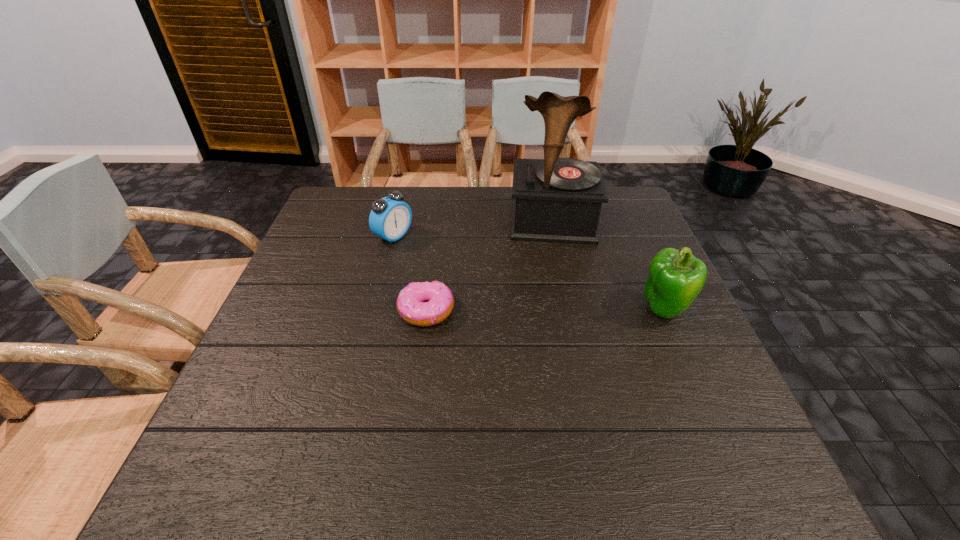
The height and width of the screenshot is (540, 960). In order to click on vacant space located 0.330m on the face of the alarm clock in this screenshot , I will do (x=505, y=294).

At what (x,y) coordinates should I click in order to perform the action: click on free space located at the horn opening of the third object from left to right. Please return your answer as a coordinate pair (x, y). The height and width of the screenshot is (540, 960). Looking at the image, I should click on (555, 269).

The image size is (960, 540). Identify the location of vacant space located 0.210m at the horn opening of the third object from left to right. (556, 298).

Where is `free space located 0.340m at the horn opening of the third object from left to right`? The width and height of the screenshot is (960, 540). free space located 0.340m at the horn opening of the third object from left to right is located at coordinates (559, 339).

Find the location of `alarm clock at the far edge`. alarm clock at the far edge is located at coordinates (390, 218).

The image size is (960, 540). I want to click on phonograph_record present at the far edge, so click(x=559, y=200).

This screenshot has height=540, width=960. What are the coordinates of `bell pepper that is at the right edge` in the screenshot? It's located at (675, 278).

In order to click on phonograph_record at the right edge in this screenshot , I will do `click(559, 200)`.

Identify the location of object present at the far right corner. (559, 200).

Find the location of a particular element. free location at the far edge is located at coordinates 483,218.